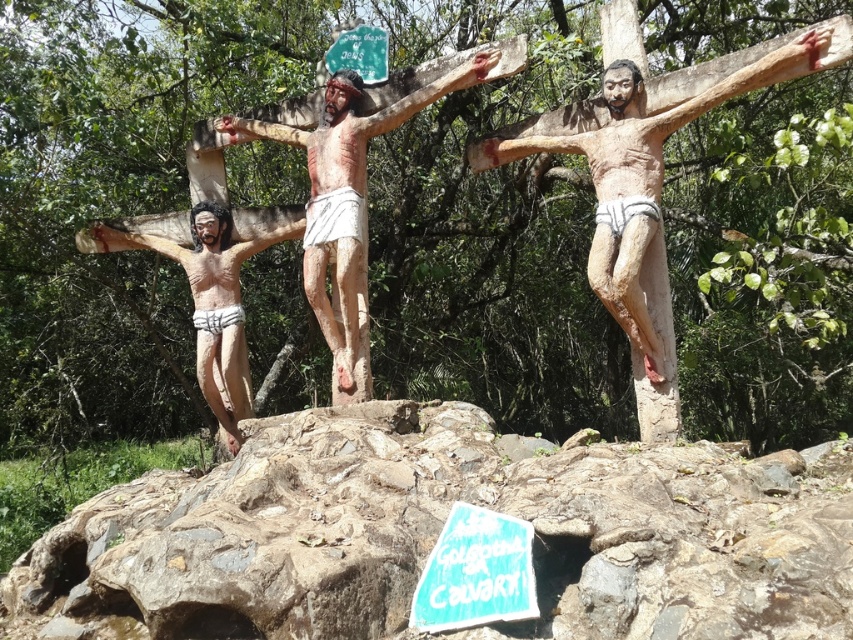
Does matte wood crucifix at center appear on the left side of matte wooden crucifix at center?

Incorrect, matte wood crucifix at center is not on the left side of matte wooden crucifix at center.

Consider the image. Can you confirm if matte wood crucifix at center is positioned above matte wooden crucifix at center?

Actually, matte wood crucifix at center is below matte wooden crucifix at center.

Between point (733, 77) and point (349, 72), which one is positioned in front?

Point (733, 77)

I want to click on matte wood crucifix at center, so click(x=639, y=186).

In the scene shown: Can you confirm if matte wood crucifix at left is shorter than blue painted wood sign at lower center?

No.

Who is higher up, matte wood crucifix at left or blue painted wood sign at lower center?

Positioned higher is matte wood crucifix at left.

Which is in front, point (231, 259) or point (447, 573)?

Point (447, 573) is in front.

The image size is (853, 640). Find the location of `matte wood crucifix at left`. matte wood crucifix at left is located at coordinates (212, 301).

Which of these two, rough stone boulder at center or matte wood crucifix at left, stands shorter?

With less height is rough stone boulder at center.

Between point (730, 481) and point (236, 406), which one is positioned in front?

Point (730, 481) is more forward.

Where is `rough stone boulder at center`? rough stone boulder at center is located at coordinates (438, 532).